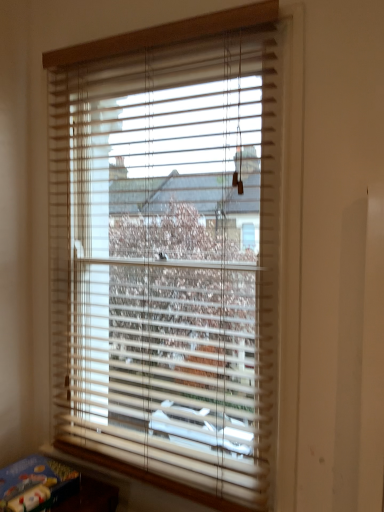
Question: Is wooden blinds at center in front of or behind blue cardboard book at lower left in the image?

Choices:
 (A) front
 (B) behind

Answer: (A)

Question: Is wooden blinds at center to the left or to the right of blue cardboard book at lower left in the image?

Choices:
 (A) left
 (B) right

Answer: (B)

Question: From the image's perspective, is wooden blinds at center positioned above or below blue cardboard book at lower left?

Choices:
 (A) above
 (B) below

Answer: (A)

Question: In terms of size, does blue cardboard book at lower left appear bigger or smaller than wooden blinds at center?

Choices:
 (A) big
 (B) small

Answer: (B)

Question: Is blue cardboard book at lower left in front of or behind wooden blinds at center in the image?

Choices:
 (A) behind
 (B) front

Answer: (A)

Question: Looking at their shapes, would you say blue cardboard book at lower left is wider or thinner than wooden blinds at center?

Choices:
 (A) thin
 (B) wide

Answer: (B)

Question: Considering the positions of blue cardboard book at lower left and wooden blinds at center in the image, is blue cardboard book at lower left taller or shorter than wooden blinds at center?

Choices:
 (A) short
 (B) tall

Answer: (A)